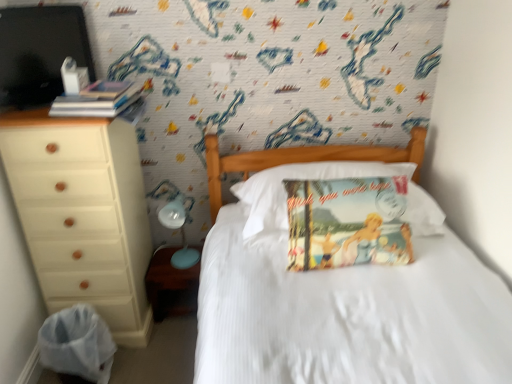
The image size is (512, 384). I want to click on vacant space situated above white plastic bag at lower left (from a real-world perspective), so click(x=77, y=321).